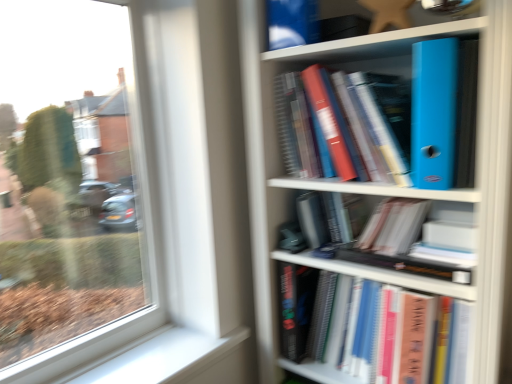
Question: Should I look upward or downward to see blue plastic folder at upper right, which is the first book from top to bottom?

Choices:
 (A) down
 (B) up

Answer: (B)

Question: From a real-world perspective, is matte plastic bookcase at right located higher than blue plastic folder at upper right, marked as the second book in a bottom-to-top arrangement?

Choices:
 (A) yes
 (B) no

Answer: (B)

Question: Considering the relative sizes of matte plastic bookcase at right and blue plastic folder at upper right, marked as the second book in a bottom-to-top arrangement, in the image provided, is matte plastic bookcase at right taller than blue plastic folder at upper right, marked as the second book in a bottom-to-top arrangement,?

Choices:
 (A) no
 (B) yes

Answer: (B)

Question: Considering the relative sizes of matte plastic bookcase at right and blue plastic folder at upper right, marked as the second book in a bottom-to-top arrangement, in the image provided, is matte plastic bookcase at right bigger than blue plastic folder at upper right, marked as the second book in a bottom-to-top arrangement,?

Choices:
 (A) yes
 (B) no

Answer: (A)

Question: Is matte plastic bookcase at right thinner than blue plastic folder at upper right, marked as the second book in a bottom-to-top arrangement?

Choices:
 (A) yes
 (B) no

Answer: (B)

Question: Does matte plastic bookcase at right have a lesser height compared to blue plastic folder at upper right, marked as the second book in a bottom-to-top arrangement?

Choices:
 (A) no
 (B) yes

Answer: (A)

Question: From a real-world perspective, is matte plastic bookcase at right located beneath blue plastic folder at upper right, marked as the second book in a bottom-to-top arrangement?

Choices:
 (A) yes
 (B) no

Answer: (A)

Question: Is blue plastic folder at upper right, which is the first book from top to bottom, located outside hardcover book at center, which is the 1th book in bottom-to-top order?

Choices:
 (A) yes
 (B) no

Answer: (A)

Question: From a real-world perspective, is blue plastic folder at upper right, which is the first book from top to bottom, physically above hardcover book at center, which is the 1th book in bottom-to-top order?

Choices:
 (A) yes
 (B) no

Answer: (A)

Question: Are blue plastic folder at upper right, which is the first book from top to bottom, and hardcover book at center, which is the second book from top to bottom, making contact?

Choices:
 (A) yes
 (B) no

Answer: (B)

Question: From a real-world perspective, is blue plastic folder at upper right, which is the first book from top to bottom, under hardcover book at center, which is the 1th book in bottom-to-top order?

Choices:
 (A) yes
 (B) no

Answer: (B)

Question: Can you confirm if blue plastic folder at upper right, marked as the second book in a bottom-to-top arrangement, is shorter than hardcover book at center, which is the second book from top to bottom?

Choices:
 (A) yes
 (B) no

Answer: (A)

Question: Considering the relative sizes of blue plastic folder at upper right, marked as the second book in a bottom-to-top arrangement, and hardcover book at center, which is the 1th book in bottom-to-top order, in the image provided, is blue plastic folder at upper right, marked as the second book in a bottom-to-top arrangement, smaller than hardcover book at center, which is the 1th book in bottom-to-top order,?

Choices:
 (A) no
 (B) yes

Answer: (B)

Question: Considering the relative sizes of matte plastic bookcase at right and hardcover book at center, which is the second book from top to bottom, in the image provided, is matte plastic bookcase at right thinner than hardcover book at center, which is the second book from top to bottom,?

Choices:
 (A) yes
 (B) no

Answer: (B)